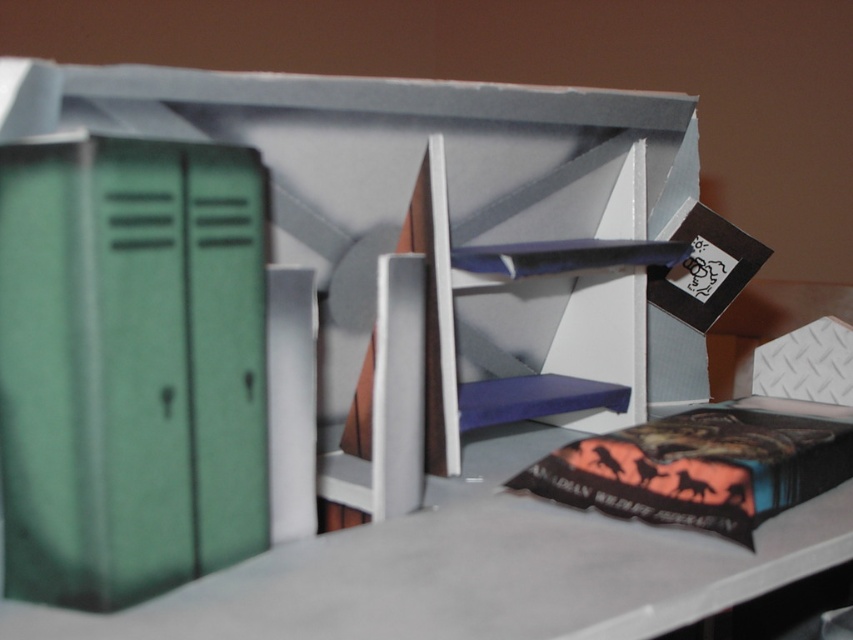
Question: Which of these objects is positioned closest to the green matte locker at left?

Choices:
 (A) orange matte book at lower right
 (B) matte black book at center

Answer: (B)

Question: Which point is closer to the camera?

Choices:
 (A) (573, 499)
 (B) (134, 472)
 (C) (26, 365)

Answer: (C)

Question: Is matte black book at center positioned at the back of green matte locker at left?

Choices:
 (A) no
 (B) yes

Answer: (A)

Question: Does green matte locker at left have a lesser width compared to orange matte book at lower right?

Choices:
 (A) yes
 (B) no

Answer: (A)

Question: Which object is farther from the camera taking this photo?

Choices:
 (A) orange matte book at lower right
 (B) green matte locker at left

Answer: (A)

Question: Can you confirm if matte black book at center is positioned to the left of orange matte book at lower right?

Choices:
 (A) yes
 (B) no

Answer: (A)